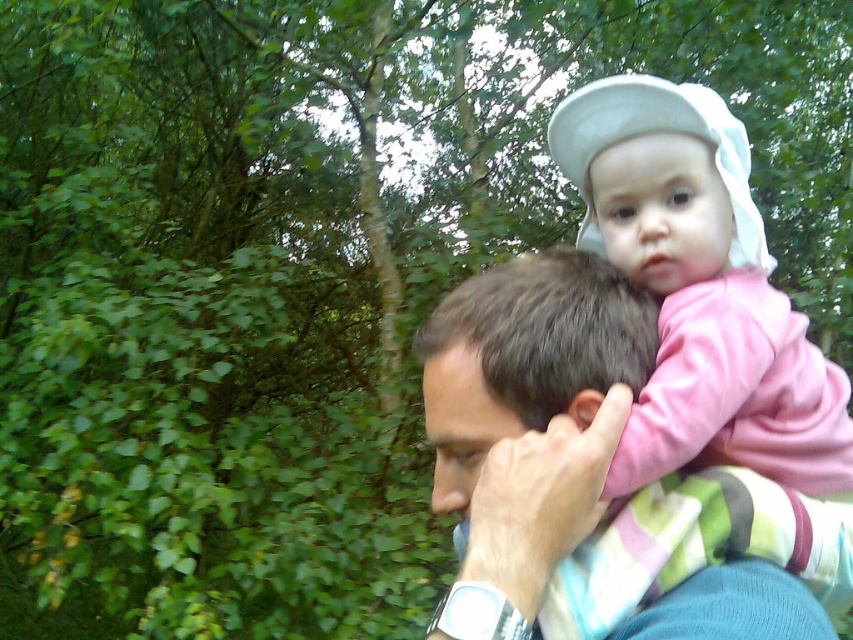
You are a photographer adjusting your camera settings to capture the man and baby clearly. The smooth blue shirt at center and the dark brown hair at center are both in focus. If the minimum focus distance for your camera is 1.5 inches, will both subjects stay in focus?

The smooth blue shirt at center is 1.76 inches away from dark brown hair at center. Since the distance between them is greater than the camera minimum focus distance of 1.5 inches, both subjects will stay in focus.

Based on the photo, you are trying to determine which clothing item in the image is wider between the smooth blue shirt at center and the blue knitted sweater at upper right. Based on the scene, can you tell which one is wider?

The smooth blue shirt at center is wider than the blue knitted sweater at upper right according to the description.

You are a photographer trying to capture the baby in the image. The baby is represented by the point at coordinates point (700,291). Where should you position your camera to ensure the baby is centered in the frame?

To center the baby represented by point (700,291) in the frame, position the camera so that the point aligns with the center of the viewfinder.